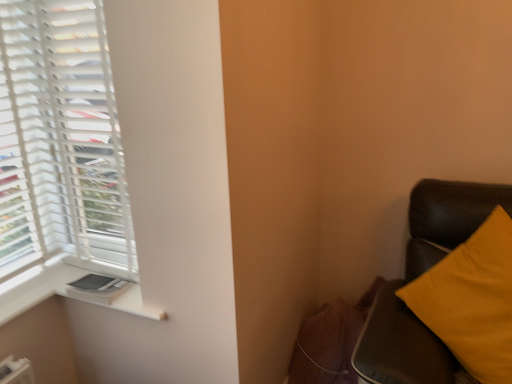
Question: Visually, is white matte blinds at left positioned to the left or to the right of matte yellow pillow at right?

Choices:
 (A) right
 (B) left

Answer: (B)

Question: From the image's perspective, is white matte blinds at left positioned above or below matte yellow pillow at right?

Choices:
 (A) above
 (B) below

Answer: (A)

Question: Which object is the closest to the white plastic window sill at lower left?

Choices:
 (A) matte yellow pillow at right
 (B) white matte blinds at left

Answer: (B)

Question: Estimate the real-world distances between objects in this image. Which object is closer to the white plastic window sill at lower left?

Choices:
 (A) matte yellow pillow at right
 (B) white matte blinds at left

Answer: (B)